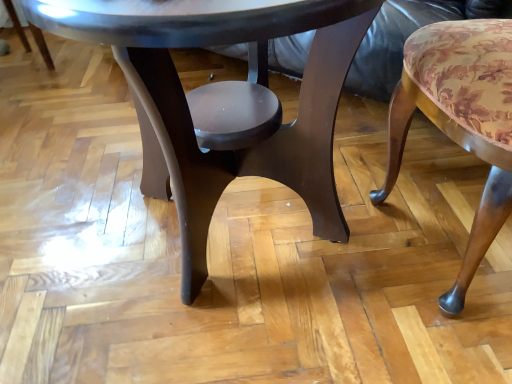
Image resolution: width=512 pixels, height=384 pixels. In order to click on free location to the left of glossy dark wood coffee table at center in this screenshot , I will do `click(62, 208)`.